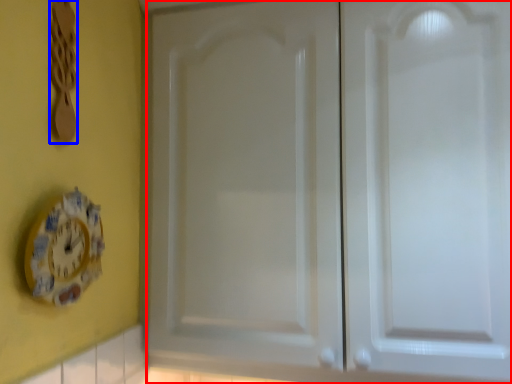
Question: Which point is further to the camera, door (highlighted by a red box) or spoon (highlighted by a blue box)?

Choices:
 (A) door
 (B) spoon

Answer: (A)